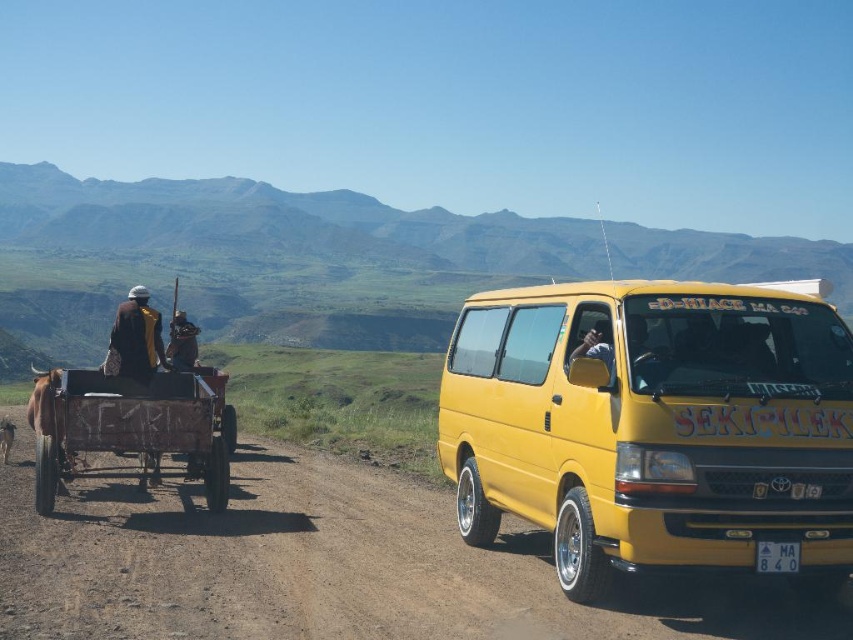
You are a photographer trying to capture both the yellow metallic van at right and the matte black shirt at center in a single frame. Since the van is larger, where should you position your camera to ensure both are visible without cropping?

The yellow metallic van at right is larger in size than the matte black shirt at center, so you should position your camera farther away from both objects to include the entire van while still capturing the matte black shirt at center in the frame.

You are a pedestrian standing on the dirt road and see the yellow metallic van at right and the yellow fabric jacket at left. Which object is taller?

The yellow fabric jacket at left is taller than the yellow metallic van at right.